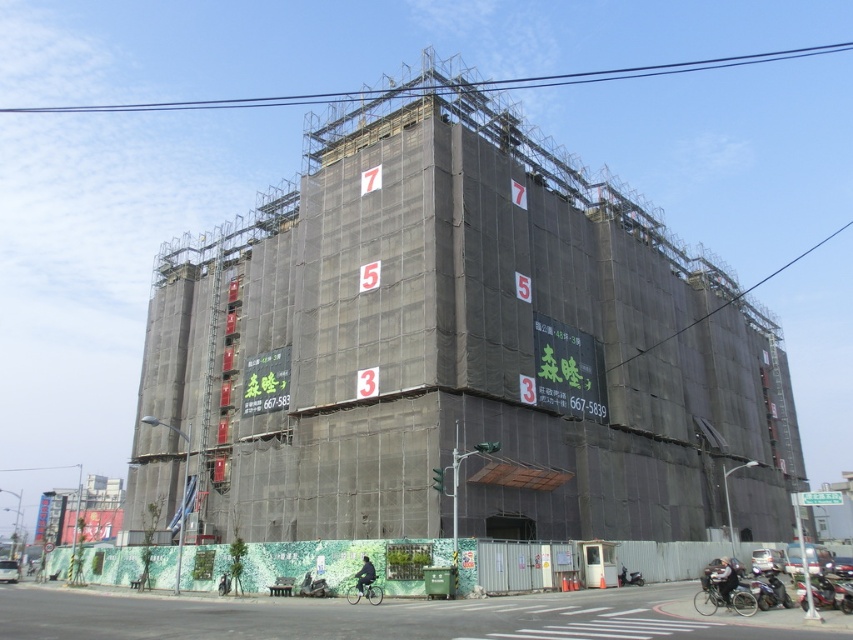
You are a delivery person needing to park your truck which is 70 feet long. You see the black fabric scaffolding at center and the green textured wall at lower center. Is there enough space between them to park your truck?

The distance between the black fabric scaffolding at center and the green textured wall at lower center is 71.85 feet, so yes, the truck can park there since it is slightly longer than the truck.

You are a delivery person trying to navigate through the construction site. You see the black fabric scaffolding at center and the green textured wall at lower center. Which object is wider from your perspective?

The black fabric scaffolding at center might be wider than green textured wall at lower center according to the description.

You are a construction worker standing at the base of the building. You need to inspect the green textured wall at lower center and the black fabric scaffolding at center. Which object is closer to your current position?

The green textured wall at lower center is closer to your current position because the black fabric scaffolding at center is to the right of it, meaning the green textured wall at lower center is positioned to the left and therefore nearer.